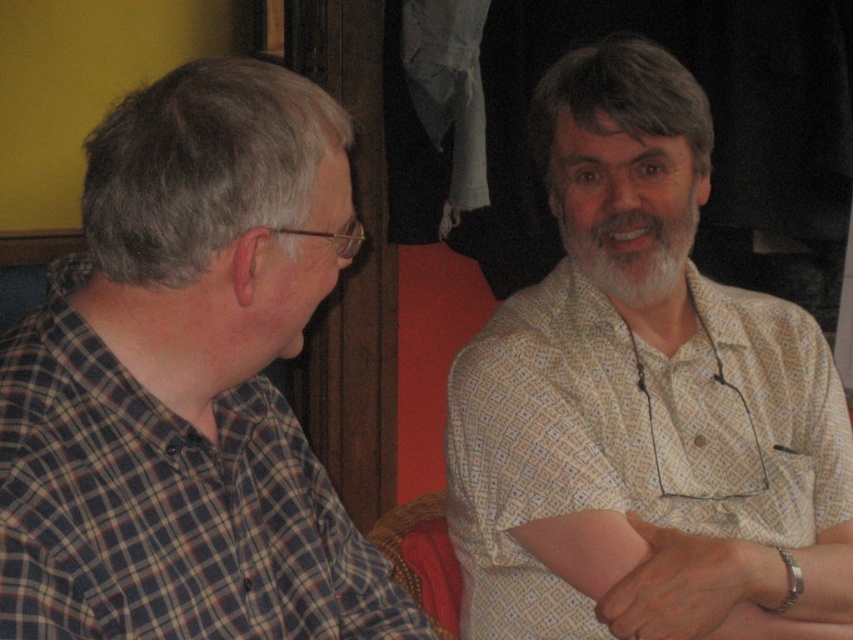
Question: Is plaid shirt at left bigger than whitehairbeard at center?

Choices:
 (A) yes
 (B) no

Answer: (A)

Question: Does plaid shirt at left lie behind white dotted shirt at upper right?

Choices:
 (A) yes
 (B) no

Answer: (B)

Question: Which of the following is the closest to the observer?

Choices:
 (A) plaid shirt at left
 (B) whitehairbeard at center

Answer: (A)

Question: Is white dotted shirt at upper right positioned in front of whitehairbeard at center?

Choices:
 (A) yes
 (B) no

Answer: (A)

Question: Considering the real-world distances, which object is closest to the white dotted shirt at upper right?

Choices:
 (A) plaid shirt at left
 (B) whitehairbeard at center

Answer: (B)

Question: Which of the following is the farthest from the observer?

Choices:
 (A) (254, 64)
 (B) (503, 442)

Answer: (B)